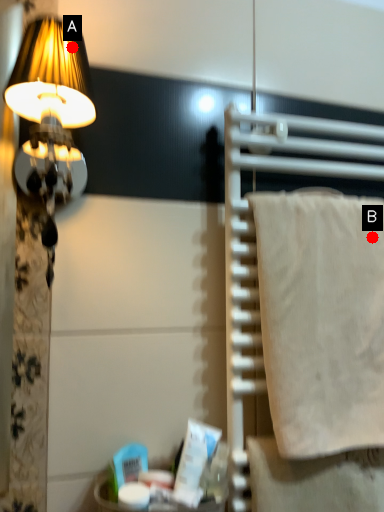
Question: Two points are circled on the image, labeled by A and B beside each circle. Which point is closer to the camera?

Choices:
 (A) A is closer
 (B) B is closer

Answer: (A)